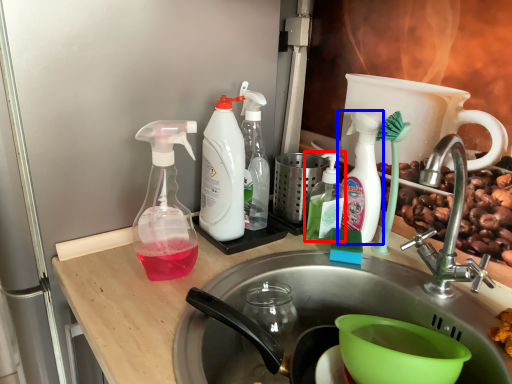
Question: Which object is further to the camera taking this photo, bottle (highlighted by a red box) or bottle (highlighted by a blue box)?

Choices:
 (A) bottle
 (B) bottle

Answer: (A)